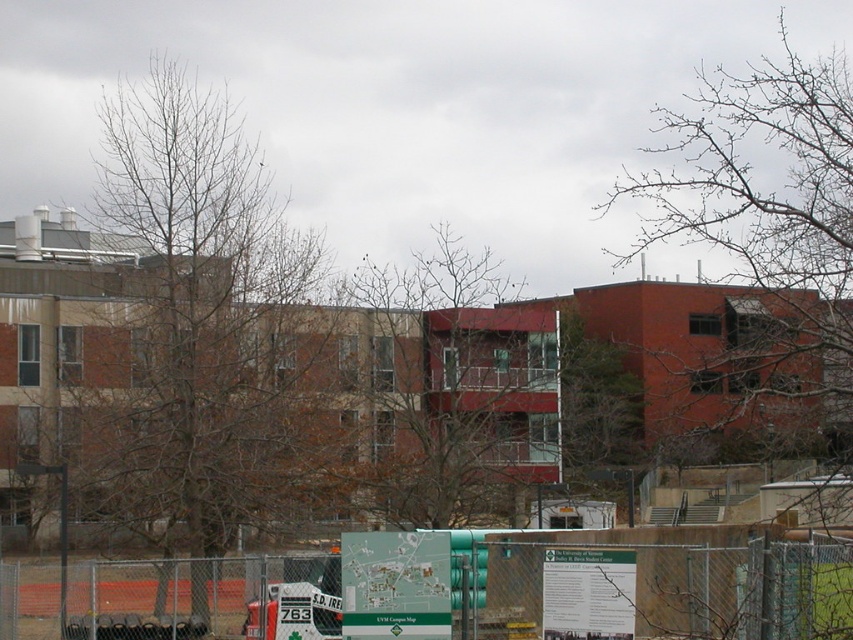
Question: Considering the relative positions of bare branches at left and bare branches at center in the image provided, where is bare branches at left located with respect to bare branches at center?

Choices:
 (A) left
 (B) right

Answer: (A)

Question: Can you confirm if bare branches at left is bigger than bare branches at upper right?

Choices:
 (A) yes
 (B) no

Answer: (B)

Question: Is bare branches at left thinner than metal chain-link fence at center?

Choices:
 (A) no
 (B) yes

Answer: (A)

Question: Which of the following is the closest to the observer?

Choices:
 (A) tap(413, 608)
 (B) tap(753, 182)

Answer: (B)

Question: Which object is the farthest from the metal chain-link fence at center?

Choices:
 (A) bare branches at center
 (B) bare branches at upper right

Answer: (B)

Question: Estimate the real-world distances between objects in this image. Which object is closer to the metal chain-link fence at center?

Choices:
 (A) bare branches at upper right
 (B) bare branches at left

Answer: (B)